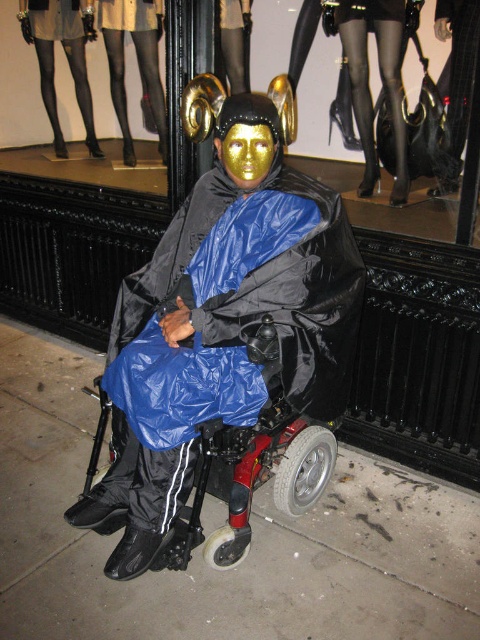
Consider the image. You are a delivery robot navigating a sidewalk. You see a concrete sidewalk at center and black tights at center. Which object is closer to the ground?

The concrete sidewalk at center is below black tights at center, so the concrete sidewalk at center is closer to the ground.

You are a delivery robot that is 1.2 meters tall. You need to approach the person in the wheelchair to deliver a package. The concrete sidewalk at center is where you must navigate. Can you safely pass under the person without hitting your head?

The distance of concrete sidewalk at center from viewer is 1.92 meters. Since the robot is 1.2 meters tall, there is enough vertical clearance to pass safely under the person without hitting the head.